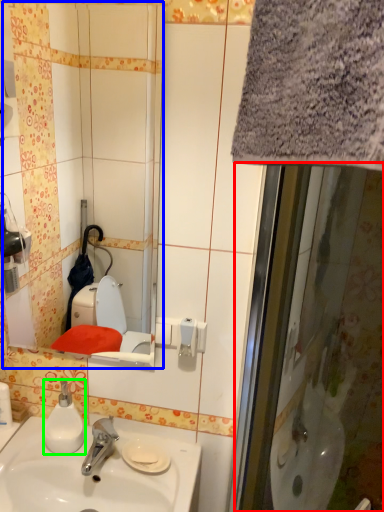
Question: Estimate the real-world distances between objects in this image. Which object is farther from screen door (highlighted by a red box), mirror (highlighted by a blue box) or soap dispenser (highlighted by a green box)?

Choices:
 (A) mirror
 (B) soap dispenser

Answer: (A)